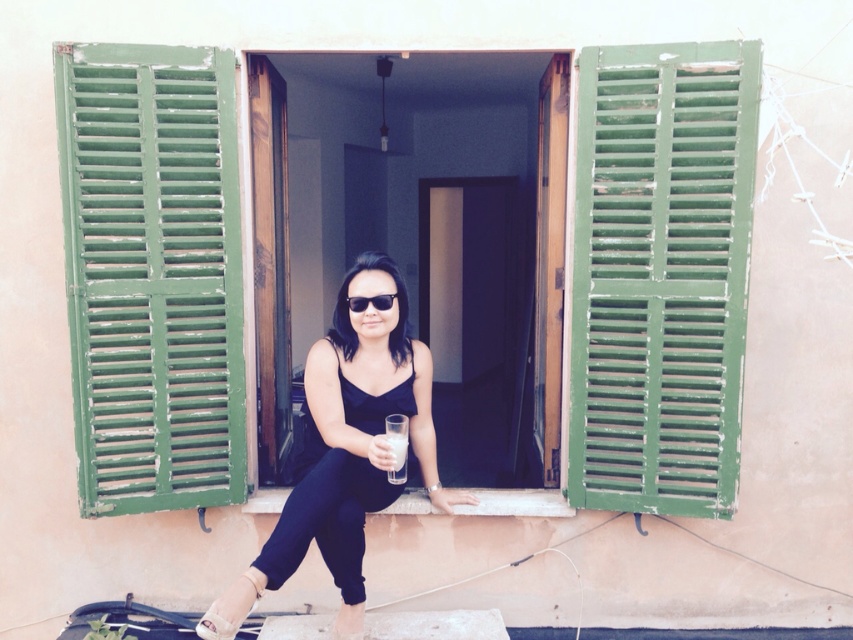
You are a window cleaner standing outside the building. You need to clean the green wooden window at center but there is a matte black dress at center in the way. Can you clean the window without moving the dress?

The matte black dress at center is behind the green wooden window at center, so you can clean the window without moving the dress because the dress is on the inside and the cleaning is done from the outside.

You are a window cleaner who needs to reach the white marble window sill at center to clean it. The window sill is at coordinates point (x=515, y=502). Can you confirm if this point is the exact location of the window sill?

Yes, the point (x=515, y=502) indicates the white marble window sill at center, so this is the exact location of the window sill.